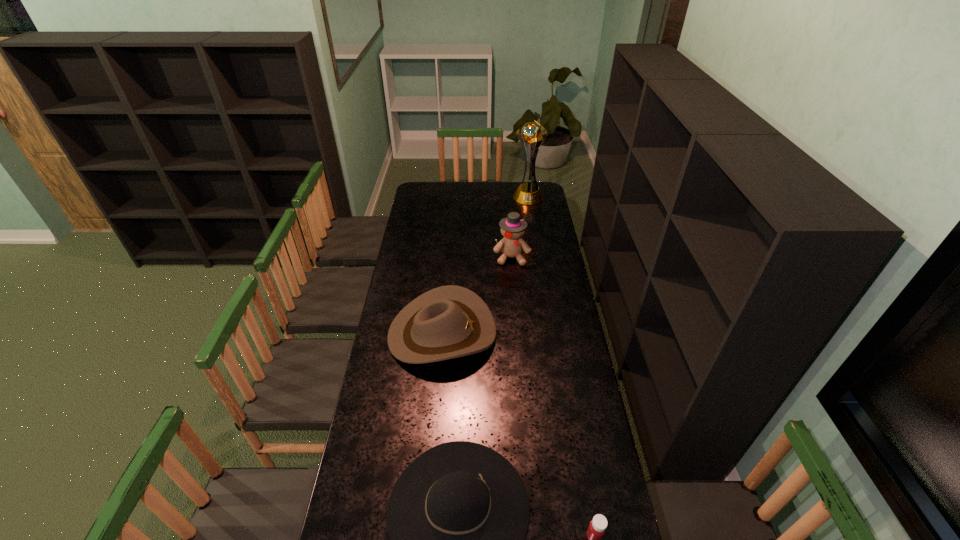
The height and width of the screenshot is (540, 960). Find the location of `the tallest object`. the tallest object is located at coordinates (532, 133).

Locate an element on the screen. the farthest object is located at coordinates (532, 133).

Identify the location of rag_doll. This screenshot has height=540, width=960. (513, 228).

This screenshot has height=540, width=960. Find the location of `the second farthest object`. the second farthest object is located at coordinates (513, 228).

At what (x,y) coordinates should I click in order to perform the action: click on the third tallest object. Please return your answer as a coordinate pair (x, y). The height and width of the screenshot is (540, 960). Looking at the image, I should click on (447, 322).

Locate an element on the screen. cowboy hat is located at coordinates (447, 322).

Locate an element on the screen. This screenshot has height=540, width=960. vacant space located on the front-facing side of the trophy is located at coordinates (532, 227).

Where is `vacant space located on the front-facing side of the fourth nearest object`? This screenshot has height=540, width=960. vacant space located on the front-facing side of the fourth nearest object is located at coordinates (516, 302).

Find the location of a particular element. free space located with a star on the front of the cowboy hat is located at coordinates (553, 333).

Locate an element on the screen. The height and width of the screenshot is (540, 960). object at the far edge is located at coordinates (532, 133).